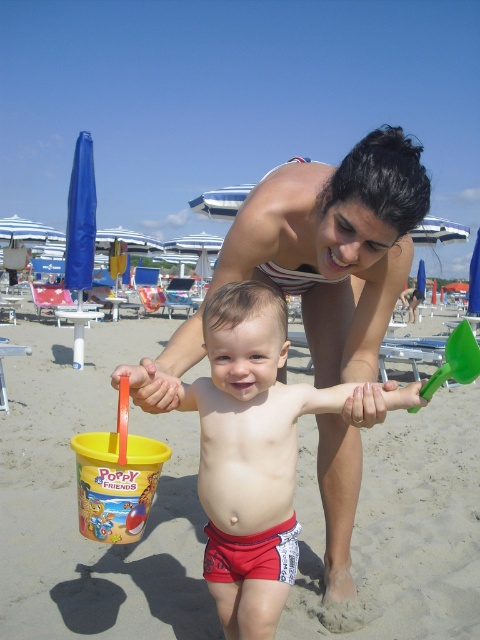
Question: Is red cotton diaper at center positioned before green plastic shovel at lower right?

Choices:
 (A) yes
 (B) no

Answer: (B)

Question: Which point is closer to the camera taking this photo?

Choices:
 (A) (446, 348)
 (B) (226, 561)
 (C) (236, 467)

Answer: (C)

Question: Is smooth red shorts at center thinner than green plastic shovel at lower right?

Choices:
 (A) no
 (B) yes

Answer: (A)

Question: Which object is closer to the camera taking this photo?

Choices:
 (A) red cotton diaper at center
 (B) green plastic shovel at lower right

Answer: (B)

Question: Which point is farther to the camera?

Choices:
 (A) (292, 426)
 (B) (231, 568)

Answer: (B)

Question: Is smooth red shorts at center thinner than red cotton diaper at center?

Choices:
 (A) yes
 (B) no

Answer: (B)